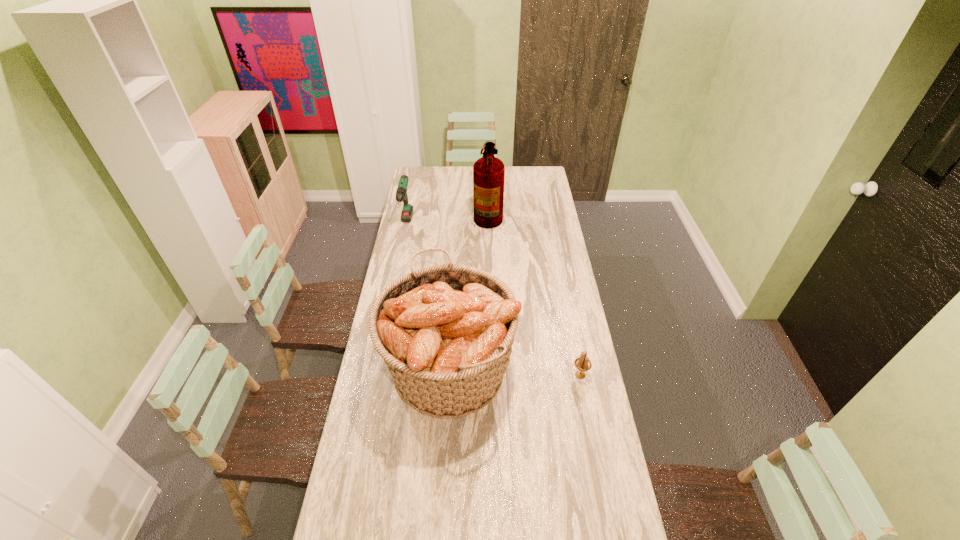
This screenshot has width=960, height=540. In order to click on vacant space in between the tallest object and the leftmost object in this screenshot , I will do `click(447, 219)`.

Find the location of `free point between the tallest object and the candle holder`. free point between the tallest object and the candle holder is located at coordinates (534, 294).

Where is `free space between the shortest object and the tallest object`? The image size is (960, 540). free space between the shortest object and the tallest object is located at coordinates (534, 294).

This screenshot has height=540, width=960. I want to click on free space that is in between the tallest object and the candle holder, so click(534, 294).

Image resolution: width=960 pixels, height=540 pixels. What are the coordinates of `vacant area that lies between the basket and the shortest object` in the screenshot? It's located at (515, 372).

This screenshot has width=960, height=540. I want to click on object that is the second closest to the leftmost object, so click(445, 332).

Where is `the closest object relative to the shortest object`? Image resolution: width=960 pixels, height=540 pixels. the closest object relative to the shortest object is located at coordinates (445, 332).

Locate an element on the screen. The height and width of the screenshot is (540, 960). blank area in the image that satisfies the following two spatial constraints: 1. on the handle side of the basket; 2. on the right side of the drill is located at coordinates (376, 368).

The width and height of the screenshot is (960, 540). What are the coordinates of `vacant space that satisfies the following two spatial constraints: 1. at the nozzle of the fire extinguisher; 2. on the handle side of the third tallest object` in the screenshot? It's located at (489, 224).

Where is `free space that satisfies the following two spatial constraints: 1. on the handle side of the rightmost object; 2. on the left side of the leftmost object`? This screenshot has width=960, height=540. free space that satisfies the following two spatial constraints: 1. on the handle side of the rightmost object; 2. on the left side of the leftmost object is located at coordinates (375, 375).